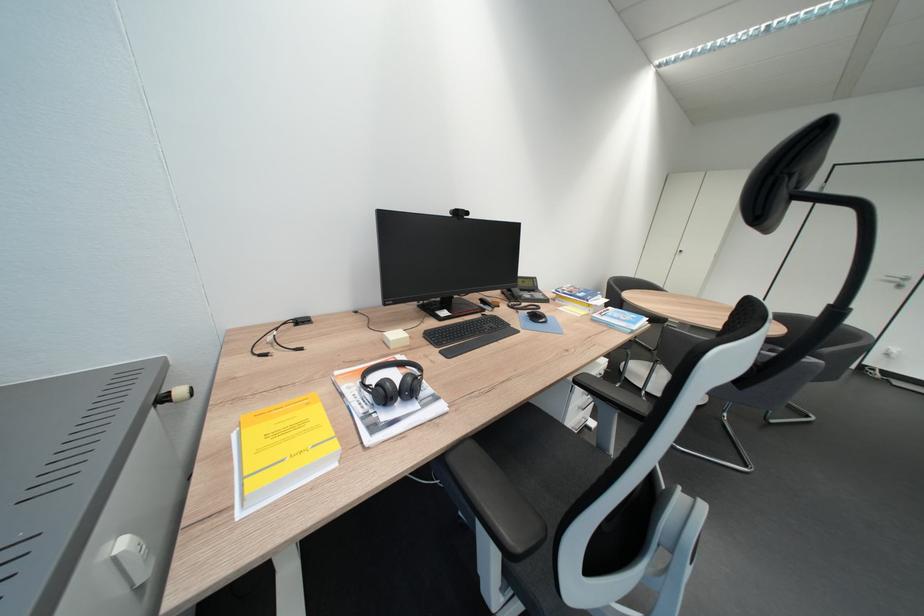
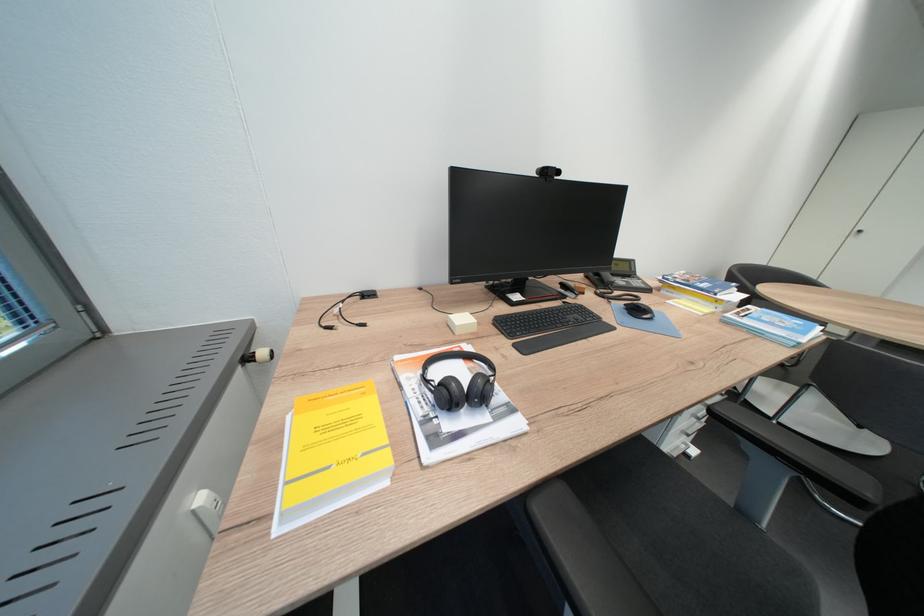
Where in the second image is the point corresponding to (520,307) from the first image?

(609, 294)